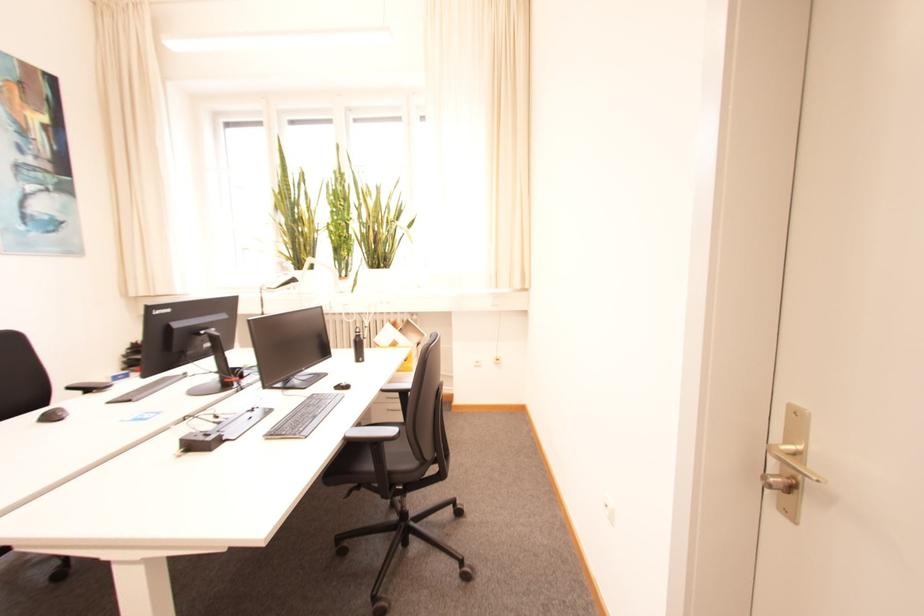
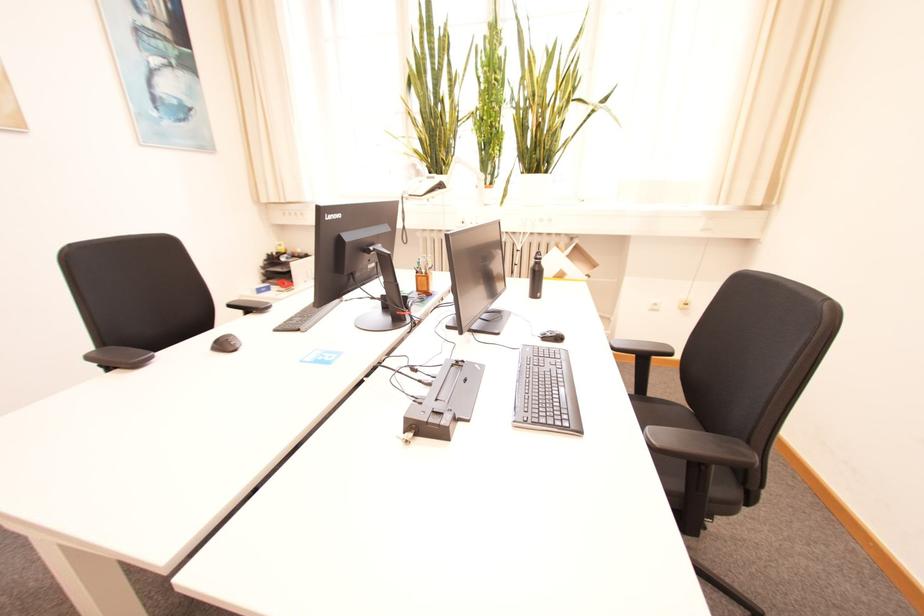
In a continuous first-person perspective shot, in which direction is the camera moving?

The cameraman moved toward left, forward.